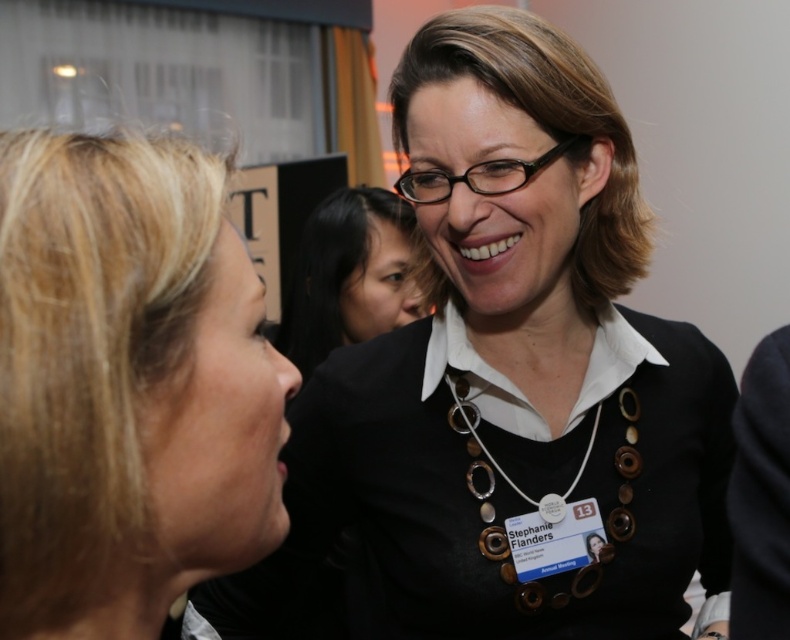
Which is above, matte black shirt at center or brown wooden beads at center?

matte black shirt at center is above.

Between point (316, 260) and point (608, 548), which one is positioned behind?

The point (316, 260) is more distant.

Where is `matte black shirt at center`? The image size is (790, 640). matte black shirt at center is located at coordinates (350, 275).

Can you confirm if black matte necklace at upper center is positioned above brown wooden beads at center?

No.

Can you confirm if black matte necklace at upper center is shorter than brown wooden beads at center?

Incorrect, black matte necklace at upper center's height does not fall short of brown wooden beads at center's.

Where is `black matte necklace at upper center`? This screenshot has width=790, height=640. black matte necklace at upper center is located at coordinates (533, 364).

Can you confirm if blonde hair at upper left is smaller than brown wooden beads at center?

No.

Is blonde hair at upper left bigger than brown wooden beads at center?

Correct, blonde hair at upper left is larger in size than brown wooden beads at center.

Which is in front, point (266, 548) or point (593, 577)?

Point (266, 548) is in front.

Locate an element on the screen. The width and height of the screenshot is (790, 640). blonde hair at upper left is located at coordinates (126, 385).